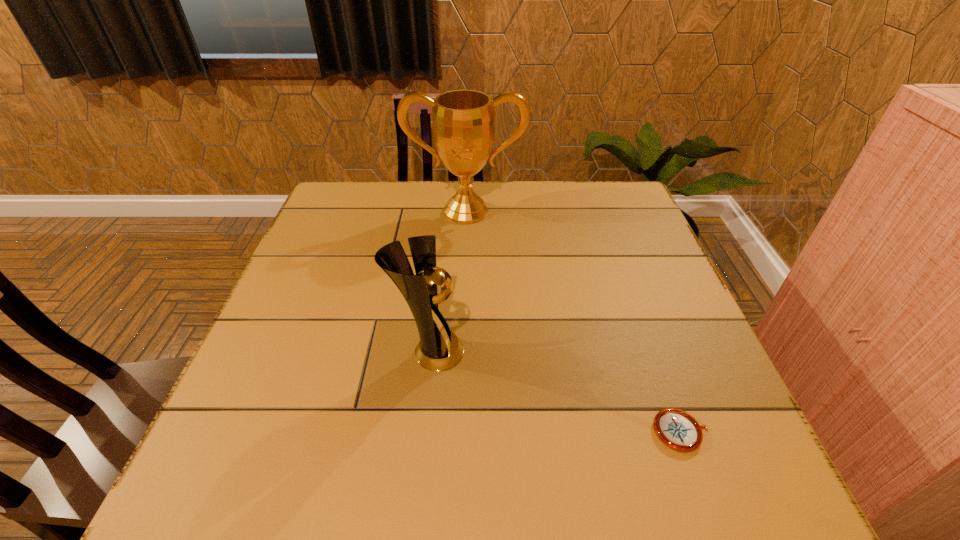
Identify the location of object that is at the near edge. The height and width of the screenshot is (540, 960). pyautogui.click(x=677, y=429).

Identify the location of object situated at the right edge. (677, 429).

Where is `object at the near right corner`? The width and height of the screenshot is (960, 540). object at the near right corner is located at coordinates 677,429.

The width and height of the screenshot is (960, 540). Find the location of `free space at the far edge`. free space at the far edge is located at coordinates (503, 192).

Find the location of a particular element. Image resolution: width=960 pixels, height=540 pixels. vacant region at the left edge is located at coordinates (342, 227).

The image size is (960, 540). Find the location of `vacant space at the right edge of the desktop`. vacant space at the right edge of the desktop is located at coordinates (633, 319).

Where is `free space at the far left corner of the desktop`? free space at the far left corner of the desktop is located at coordinates (343, 195).

In the image, there is a desktop. What are the coordinates of `vacant space at the far right corner` in the screenshot? It's located at (603, 185).

At what (x,y) coordinates should I click in order to perform the action: click on free space between the nearest object and the second farthest object. Please return your answer as a coordinate pair (x, y). Looking at the image, I should click on (555, 392).

Find the location of a particular element. The height and width of the screenshot is (540, 960). empty space that is in between the compass and the farther award is located at coordinates (573, 321).